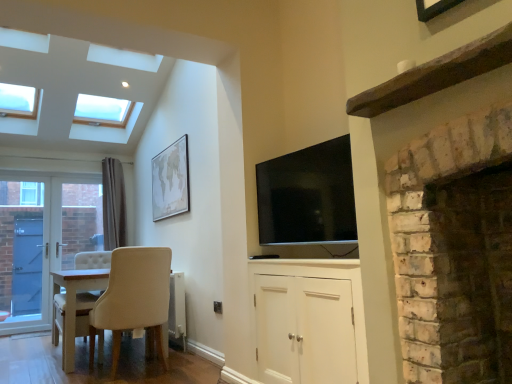
Describe the element at coordinates (307, 196) in the screenshot. The image size is (512, 384). I see `flat screen tv at upper center` at that location.

What is the approximate height of beige fabric chair at lower left?

It is 30.86 inches.

What is the approximate width of blue glass door at left?

4.15 inches.

From the picture: Measure the distance between beige matte map at upper center and camera.

The depth of beige matte map at upper center is 4.12 meters.

Locate an element on the screen. The width and height of the screenshot is (512, 384). white brick fireplace at right is located at coordinates (454, 249).

Is point (463, 222) positioned behind point (180, 149)?

That is False.

Based on their sizes in the image, would you say white brick fireplace at right is bigger or smaller than beige matte map at upper center?

Clearly, white brick fireplace at right is larger in size than beige matte map at upper center.

From a real-world perspective, which is physically below, white brick fireplace at right or beige matte map at upper center?

white brick fireplace at right, from a real-world perspective.

At what (x,y) coordinates should I click in order to perform the action: click on glass door above the white wooden door at left (from a real-world perspective). Please return your answer as a coordinate pair (x, y). Image resolution: width=512 pixels, height=384 pixels. Looking at the image, I should click on (22, 248).

Is white wooden door at left not within blue glass door at left?

No, white wooden door at left is inside blue glass door at left's boundary.

Which is in front, white wooden door at left or blue glass door at left?

blue glass door at left is in front.

From the image's perspective, which object appears higher, white matte cabinet at center or beige matte map at upper center?

beige matte map at upper center is shown above in the image.

Is white matte cabinet at center bigger than beige matte map at upper center?

Yes, white matte cabinet at center is bigger than beige matte map at upper center.

Is white matte cabinet at center oriented away from beige matte map at upper center?

No, beige matte map at upper center is not at the back of white matte cabinet at center.

Which is closer, (286, 271) or (154, 193)?

Point (286, 271) appears to be closer to the viewer than point (154, 193).

Between point (172, 203) and point (473, 271), which one is positioned in front?

The point (473, 271) is more forward.

Is beige matte map at upper center surrounding white brick fireplace at right?

No, white brick fireplace at right is located outside of beige matte map at upper center.

In the scene shown: From the image's perspective, is beige matte map at upper center under white brick fireplace at right?

Actually, beige matte map at upper center appears above white brick fireplace at right in the image.

Consider the image. Which object is positioned more to the left, blue glass door at left or flat screen tv at upper center?

blue glass door at left.

Is flat screen tv at upper center at the back of blue glass door at left?

No.

You are a GUI agent. You are given a task and a screenshot of the screen. Output one action in this format:
    pyautogui.click(x=<x>, y=<y>)
    Task: Click on the television above the blue glass door at left (from the image's perspective)
    This screenshot has height=384, width=512.
    Given the screenshot: What is the action you would take?
    pyautogui.click(x=307, y=196)

From the picture: Which object is closer to the camera taking this photo, blue glass door at left or flat screen tv at upper center?

flat screen tv at upper center is in front.

How distant is white matte cabinet at center from flat screen tv at upper center?

The distance of white matte cabinet at center from flat screen tv at upper center is 16.34 inches.

Considering their positions, is white matte cabinet at center located in front of or behind flat screen tv at upper center?

white matte cabinet at center is in front of flat screen tv at upper center.

From a real-world perspective, which object rests below the other?

In real-world perspective, white matte cabinet at center is lower.

What's the angular difference between white matte cabinet at center and flat screen tv at upper center's facing directions?

They differ by 0.000179 degrees in their facing directions.

Which is behind, flat screen tv at upper center or white matte cabinet at center?

Positioned behind is flat screen tv at upper center.

Which of these two, flat screen tv at upper center or white matte cabinet at center, is bigger?

Bigger between the two is white matte cabinet at center.

Which object is wider, flat screen tv at upper center or white matte cabinet at center?

white matte cabinet at center.

Where is `picture frame that is behind the white brick fireplace at right`? The height and width of the screenshot is (384, 512). picture frame that is behind the white brick fireplace at right is located at coordinates (170, 180).

Identify the location of door below the blue glass door at left (from the image's perspective). The height and width of the screenshot is (384, 512). (42, 241).

From the image, which object appears to be farther from blue glass door at left, beige fabric chair at lower left or flat screen tv at upper center?

flat screen tv at upper center.

From the image, which object appears to be nearer to beige matte map at upper center, white brick fireplace at right or flat screen tv at upper center?

flat screen tv at upper center is positioned closer to the anchor beige matte map at upper center.

Based on their spatial positions, is beige fabric chair at lower left or blue glass door at left closer to white wooden door at left?

Based on the image, blue glass door at left appears to be nearer to white wooden door at left.

Based on their spatial positions, is beige fabric chair at lower left or white wooden door at left further from white brick fireplace at right?

Based on the image, white wooden door at left appears to be further to white brick fireplace at right.

Based on the photo, looking at the image, which one is located further to beige fabric chair at lower left, beige matte map at upper center or white wooden door at left?

white wooden door at left.

When comparing their distances from beige fabric chair at lower left, does beige matte map at upper center or flat screen tv at upper center seem further?

Among the two, flat screen tv at upper center is located further to beige fabric chair at lower left.

Looking at the image, which one is located closer to blue glass door at left, beige matte map at upper center or white matte cabinet at center?

Among the two, beige matte map at upper center is located nearer to blue glass door at left.

Which object lies further to the anchor point flat screen tv at upper center, white brick fireplace at right or white wooden door at left?

white wooden door at left lies further to flat screen tv at upper center than the other object.

Where is `picture frame between blue glass door at left and flat screen tv at upper center`? picture frame between blue glass door at left and flat screen tv at upper center is located at coordinates click(x=170, y=180).

The height and width of the screenshot is (384, 512). I want to click on picture frame positioned between flat screen tv at upper center and white wooden door at left from near to far, so [170, 180].

Identify the location of television positioned between white brick fireplace at right and white wooden door at left from near to far. This screenshot has height=384, width=512. (307, 196).

You are a GUI agent. You are given a task and a screenshot of the screen. Output one action in this format:
    pyautogui.click(x=<x>, y=<y>)
    Task: Click on the chair positioned between flat screen tv at upper center and white wooden door at left from near to far
    
    Given the screenshot: What is the action you would take?
    pyautogui.click(x=122, y=300)